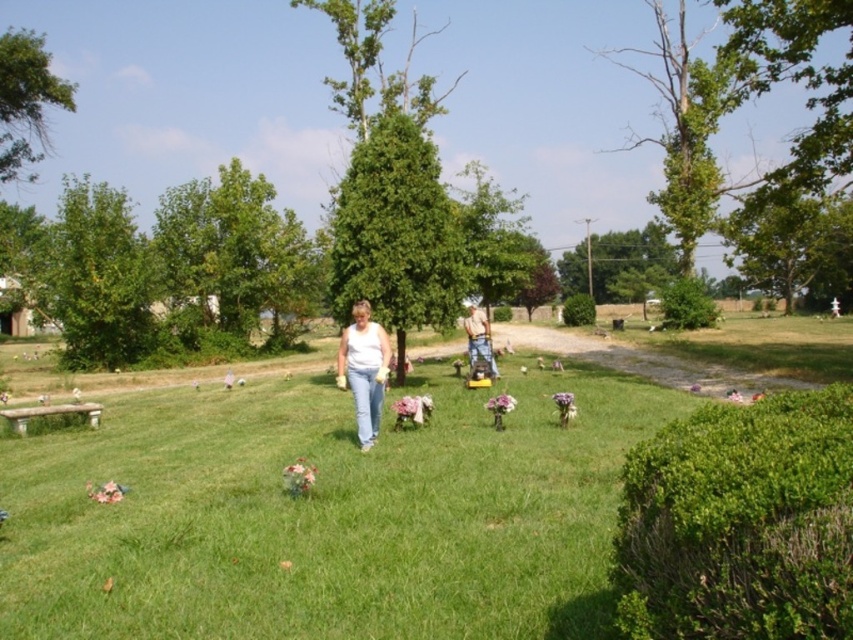
You are standing in the cemetery and see the white cotton shirt at center and denim jeans at center. Which clothing item is shorter in height?

The white cotton shirt at center is shorter in height than the denim jeans at center.

You are standing in the cemetery scene and see the green grass lawn at center and the denim jeans at center. Which object is positioned to the left of the other?

The green grass lawn at center is to the left of denim jeans at center.